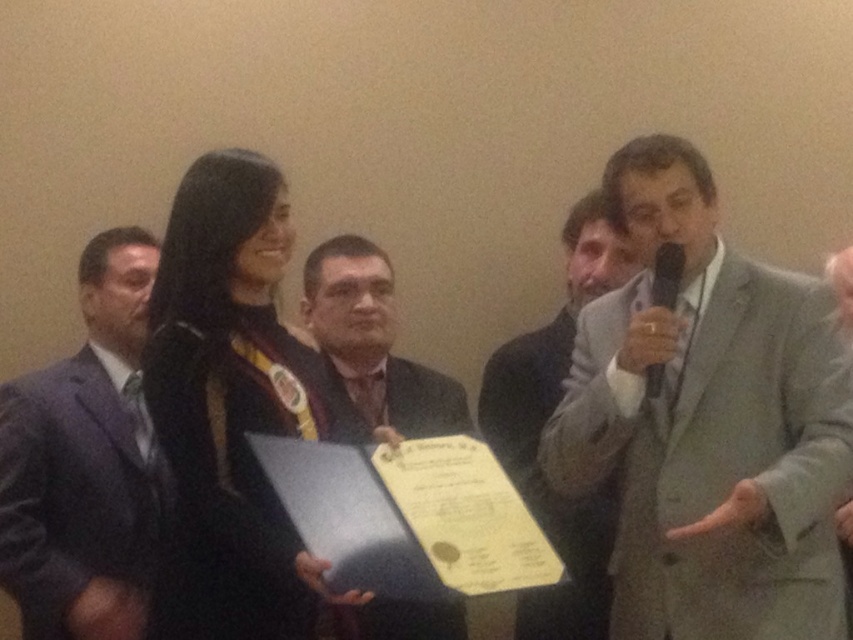
Does light gray suit at right have a smaller size compared to black plastic microphone at upper right?

Actually, light gray suit at right might be larger than black plastic microphone at upper right.

Who is more forward, [572,324] or [647,388]?

Point [647,388] is more forward.

Is point (537, 518) closer to viewer compared to point (654, 291)?

No.

You are a GUI agent. You are given a task and a screenshot of the screen. Output one action in this format:
    pyautogui.click(x=<x>, y=<y>)
    Task: Click on the light gray suit at right
    This screenshot has width=853, height=640.
    Given the screenshot: What is the action you would take?
    pyautogui.click(x=543, y=428)

Which is below, black satin business suit at center or matte black suit at center?

black satin business suit at center is lower down.

Can you confirm if black satin business suit at center is shorter than matte black suit at center?

No, black satin business suit at center is not shorter than matte black suit at center.

Does point (171, 326) lie in front of point (341, 426)?

Yes, it is.

Locate an element on the screen. Image resolution: width=853 pixels, height=640 pixels. black satin business suit at center is located at coordinates (233, 476).

Can you confirm if light gray suit at right is positioned to the left of matte black microphone at right?

Indeed, light gray suit at right is positioned on the left side of matte black microphone at right.

Is light gray suit at right smaller than matte black microphone at right?

Actually, light gray suit at right might be larger than matte black microphone at right.

Does point (512, 481) come farther from viewer compared to point (654, 358)?

Yes, point (512, 481) is behind point (654, 358).

At what (x,y) coordinates should I click in order to perform the action: click on light gray suit at right. Please return your answer as a coordinate pair (x, y). This screenshot has width=853, height=640. Looking at the image, I should click on (543, 428).